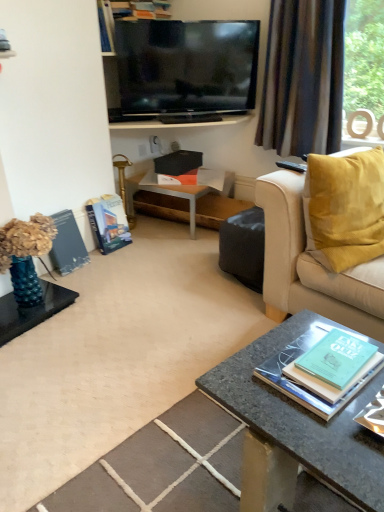
Where is `vacant space to the left of green matte book at lower right, the 1th book positioned from the right`? This screenshot has width=384, height=512. vacant space to the left of green matte book at lower right, the 1th book positioned from the right is located at coordinates (246, 379).